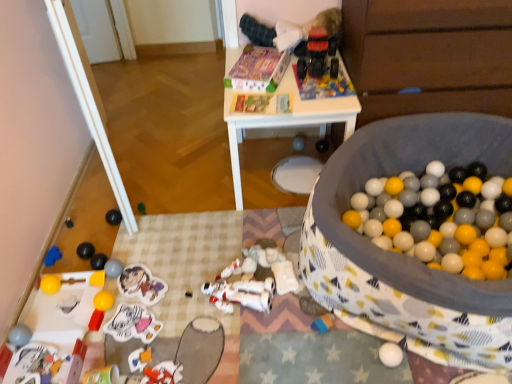
This screenshot has height=384, width=512. Identify the location of free space to the left of white matte robot at center, placed as the 7th toy when sorted from right to left. (178, 297).